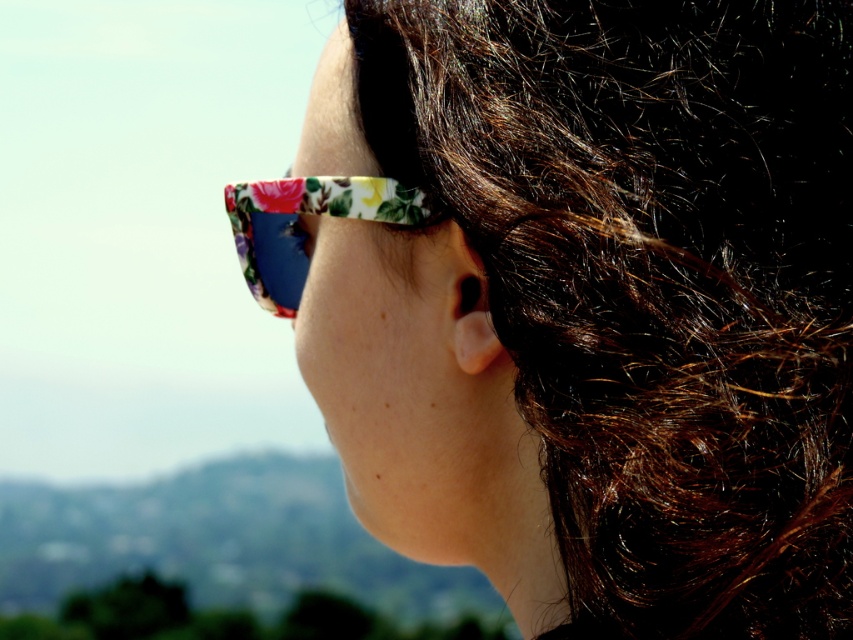
You are taking a photo of the person wearing sunglasses with floral patterns. You notice two points in the image at coordinates point [432,243] and point [370,182]. Which point is closer to the camera?

Point [432,243] is closer to the camera than point [370,182].